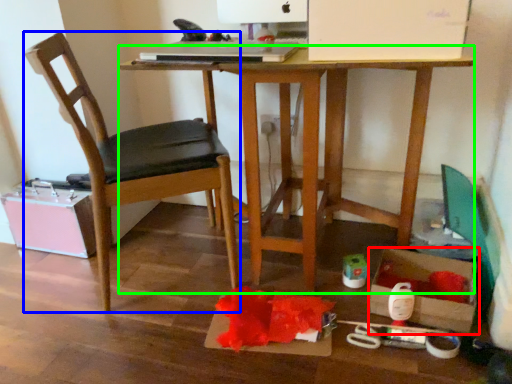
Question: Based on their relative distances, which object is nearer to storage box (highlighted by a red box)? Choose from chair (highlighted by a blue box) and desk (highlighted by a green box).

Choices:
 (A) chair
 (B) desk

Answer: (B)